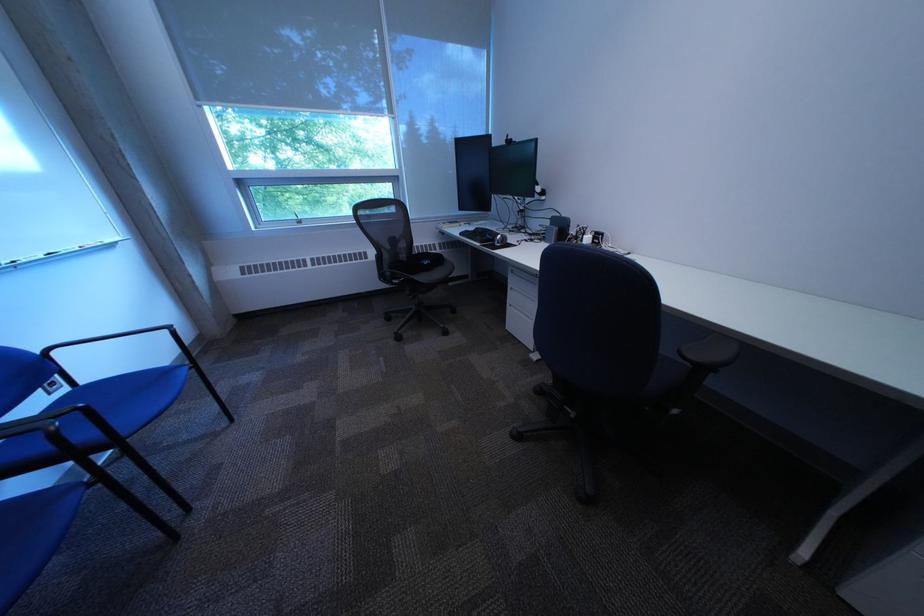
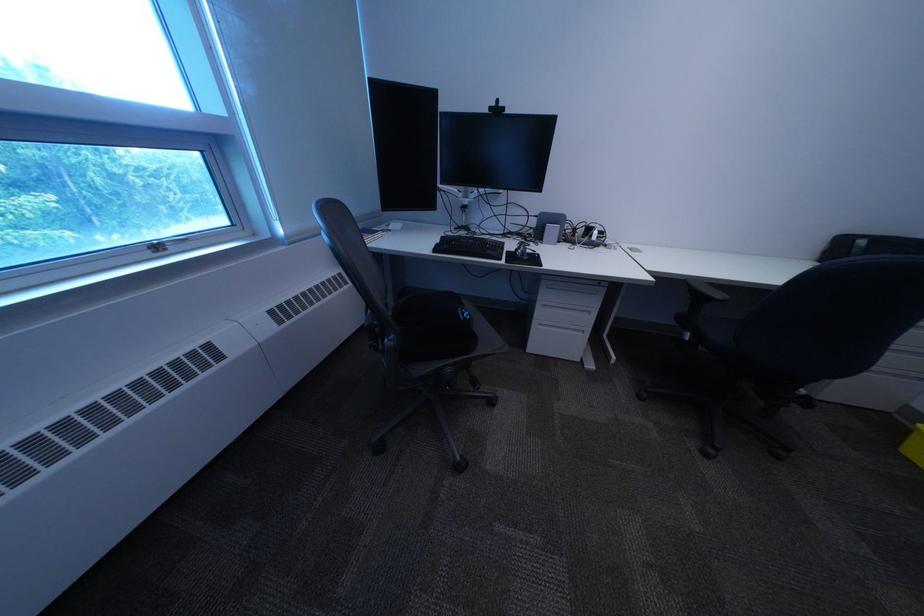
Find the pixel in the second image that matches (x=477, y=236) in the first image.

(451, 252)